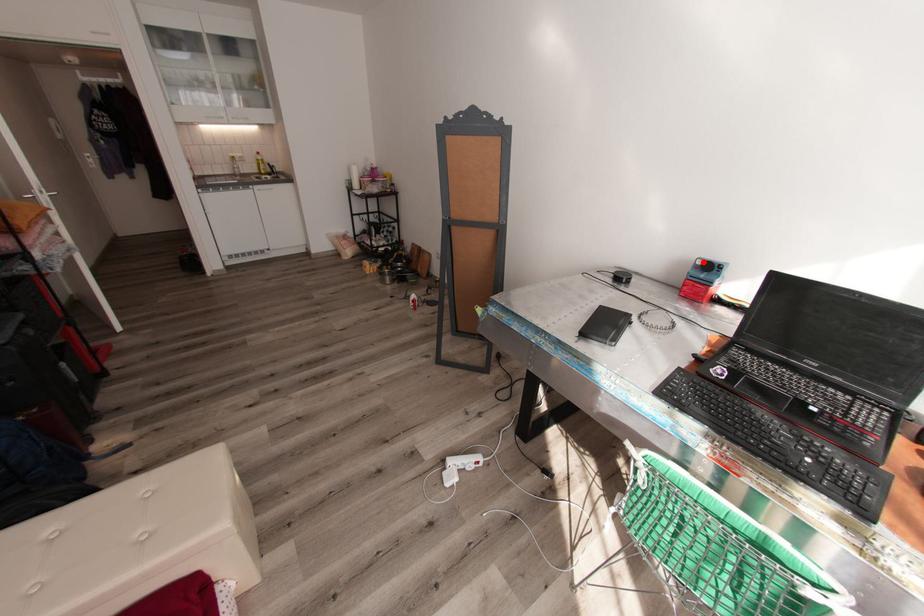
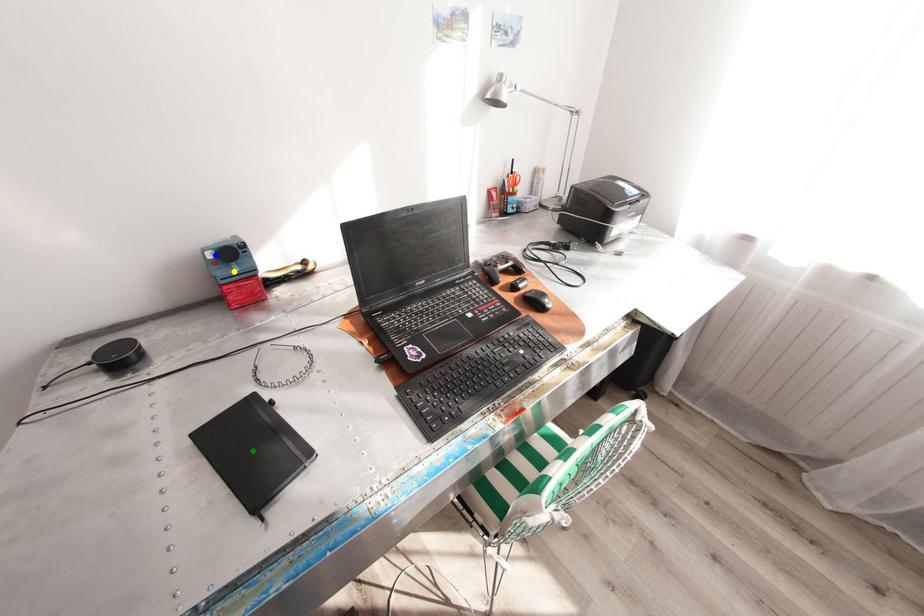
Question: I am providing you with two images of the same scene from different viewpoints. A red point is marked on the first image. You are given multiple points on the second image. Which spot in image 2 lines up with the point in image 1?

Choices:
 (A) green point
 (B) blue point
 (C) yellow point

Answer: (B)